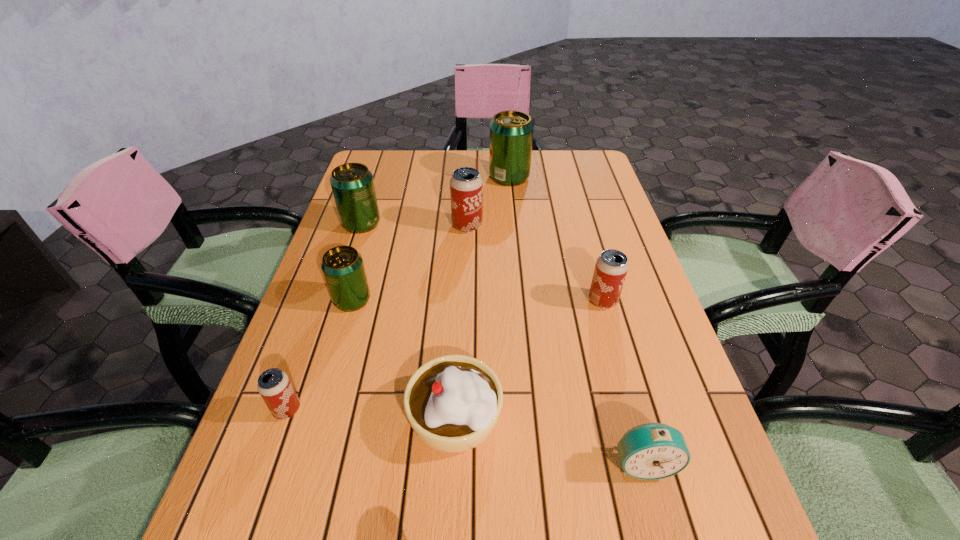
What are the coordinates of `red beer can that is the third closest to the farthest object` in the screenshot? It's located at (274, 385).

Choose which red beer can is the nearest neighbor to the alarm clock. Please provide its 2D coordinates. Your answer should be formatted as a tuple, i.e. [(x, y)], where the tuple contains the x and y coordinates of a point satisfying the conditions above.

[(611, 267)]

Find the location of `vacant area that satisfies the following two spatial constraints: 1. on the front side of the whipped cream; 2. on the left side of the nearest red beer can`. vacant area that satisfies the following two spatial constraints: 1. on the front side of the whipped cream; 2. on the left side of the nearest red beer can is located at coordinates (285, 416).

Locate an element on the screen. The width and height of the screenshot is (960, 540). free space that satisfies the following two spatial constraints: 1. on the front side of the farthest red beer can; 2. on the right side of the second biggest green beer can is located at coordinates (360, 226).

The width and height of the screenshot is (960, 540). I want to click on vacant position in the image that satisfies the following two spatial constraints: 1. on the back side of the whipped cream; 2. on the right side of the tallest beer can, so click(466, 177).